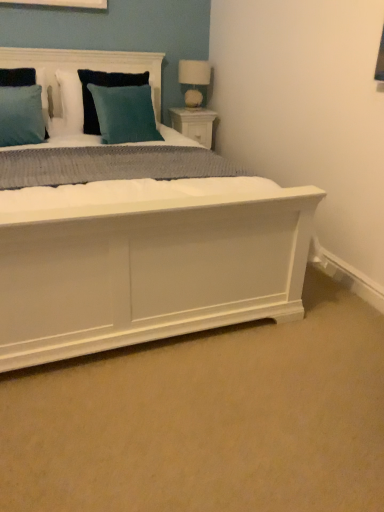
Question: Does teal fabric pillow at upper center, arranged as the first pillow when viewed from the back, appear on the left side of white wood nightstand at upper right?

Choices:
 (A) no
 (B) yes

Answer: (B)

Question: Considering the relative positions of teal fabric pillow at upper center, arranged as the first pillow when viewed from the back, and white wood nightstand at upper right in the image provided, is teal fabric pillow at upper center, arranged as the first pillow when viewed from the back, to the right of white wood nightstand at upper right from the viewer's perspective?

Choices:
 (A) no
 (B) yes

Answer: (A)

Question: From a real-world perspective, is teal fabric pillow at upper center, the third pillow positioned from the front, over white wood nightstand at upper right?

Choices:
 (A) yes
 (B) no

Answer: (A)

Question: Does teal fabric pillow at upper center, the third pillow positioned from the front, contain white wood nightstand at upper right?

Choices:
 (A) no
 (B) yes

Answer: (A)

Question: From the image's perspective, is teal fabric pillow at upper center, arranged as the first pillow when viewed from the back, under white wood nightstand at upper right?

Choices:
 (A) no
 (B) yes

Answer: (A)

Question: From a real-world perspective, is white wood nightstand at upper right above or below teal fabric pillow at upper center, the third pillow positioned from the front?

Choices:
 (A) above
 (B) below

Answer: (B)

Question: Is white wood nightstand at upper right taller or shorter than teal fabric pillow at upper center, arranged as the first pillow when viewed from the back?

Choices:
 (A) tall
 (B) short

Answer: (B)

Question: Looking at their shapes, would you say white wood nightstand at upper right is wider or thinner than teal fabric pillow at upper center, the third pillow positioned from the front?

Choices:
 (A) thin
 (B) wide

Answer: (B)

Question: Considering the positions of point (208, 111) and point (67, 106), is point (208, 111) closer or farther from the camera than point (67, 106)?

Choices:
 (A) farther
 (B) closer

Answer: (A)

Question: Is teal velvet pillow at upper center, which appears as the second pillow when viewed from the back, wider or thinner than white wood nightstand at upper right?

Choices:
 (A) wide
 (B) thin

Answer: (A)

Question: From the image's perspective, is teal velvet pillow at upper center, which is counted as the 2th pillow, starting from the front, located above or below white wood nightstand at upper right?

Choices:
 (A) below
 (B) above

Answer: (A)

Question: Is teal velvet pillow at upper center, which is counted as the 2th pillow, starting from the front, in front of or behind white wood nightstand at upper right in the image?

Choices:
 (A) front
 (B) behind

Answer: (A)

Question: In terms of size, does teal velvet pillow at upper center, which is counted as the 2th pillow, starting from the front, appear bigger or smaller than white wood nightstand at upper right?

Choices:
 (A) small
 (B) big

Answer: (B)

Question: In the image, is teal fabric pillow at upper center on the left side or the right side of white fabric lampshade at upper right?

Choices:
 (A) right
 (B) left

Answer: (B)

Question: Considering the positions of point (49, 49) and point (200, 61), is point (49, 49) closer or farther from the camera than point (200, 61)?

Choices:
 (A) closer
 (B) farther

Answer: (A)